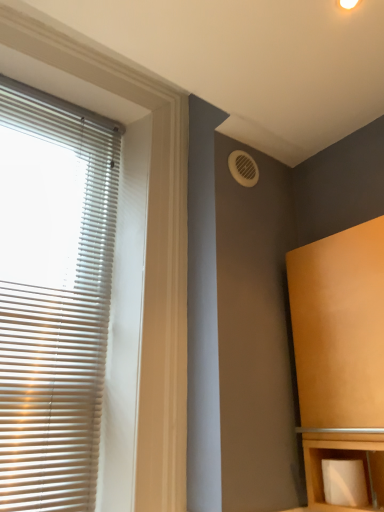
Question: Should I look upward or downward to see white plastic vent at upper right?

Choices:
 (A) down
 (B) up

Answer: (B)

Question: Are white matte toilet paper at lower right and matte wood cabinet at right far apart?

Choices:
 (A) no
 (B) yes

Answer: (A)

Question: Does white matte toilet paper at lower right have a larger size compared to matte wood cabinet at right?

Choices:
 (A) no
 (B) yes

Answer: (A)

Question: Is white matte toilet paper at lower right surrounding matte wood cabinet at right?

Choices:
 (A) no
 (B) yes

Answer: (A)

Question: Is white matte toilet paper at lower right beside matte wood cabinet at right?

Choices:
 (A) yes
 (B) no

Answer: (B)

Question: Is white matte toilet paper at lower right not inside matte wood cabinet at right?

Choices:
 (A) no
 (B) yes

Answer: (A)

Question: Could you tell me if white matte toilet paper at lower right is turned towards matte wood cabinet at right?

Choices:
 (A) yes
 (B) no

Answer: (A)

Question: Is matte wood cabinet at right bigger than white matte blinds at left?

Choices:
 (A) no
 (B) yes

Answer: (B)

Question: Is matte wood cabinet at right turned away from white matte blinds at left?

Choices:
 (A) yes
 (B) no

Answer: (B)

Question: From the image's perspective, is matte wood cabinet at right under white matte blinds at left?

Choices:
 (A) yes
 (B) no

Answer: (A)

Question: Is white matte blinds at left completely or partially inside matte wood cabinet at right?

Choices:
 (A) no
 (B) yes

Answer: (A)

Question: Can you confirm if matte wood cabinet at right is smaller than white matte blinds at left?

Choices:
 (A) no
 (B) yes

Answer: (A)

Question: Considering the relative positions of matte wood cabinet at right and white matte blinds at left in the image provided, is matte wood cabinet at right to the right of white matte blinds at left from the viewer's perspective?

Choices:
 (A) yes
 (B) no

Answer: (A)

Question: Is matte wood cabinet at right further to the viewer compared to white matte toilet paper at lower right?

Choices:
 (A) no
 (B) yes

Answer: (A)